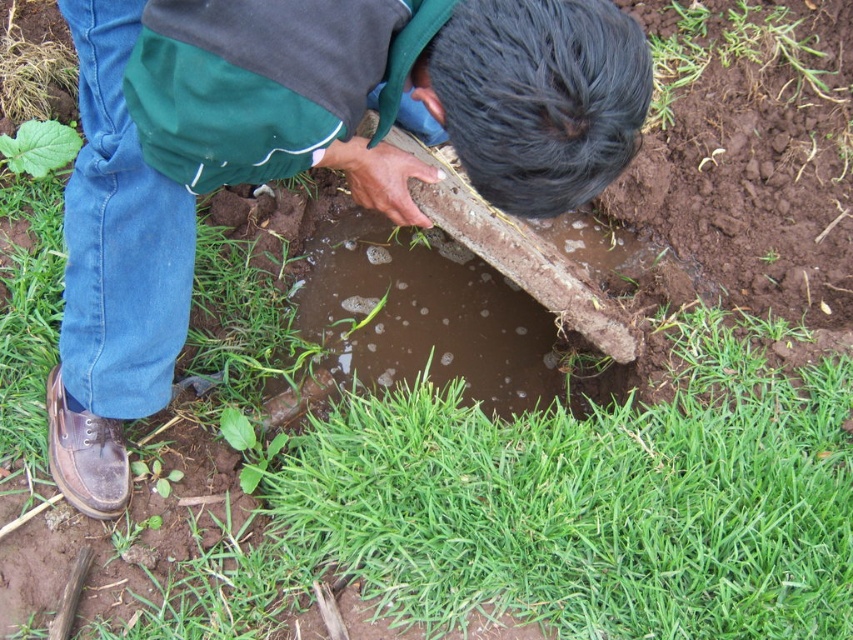
The man is holding a rectangular concrete block. He wants to place it so that it is partially submerged in water. The brown clay shovel at center is in front of green grass at lower center. Where should he place the block relative to the shovel and grass?

The man should place the rectangular concrete block behind the brown clay shovel at center, which is in front of the green grass at lower center, to ensure it is partially submerged in the water.

You are a farmer who needs to choose between the brown clay shovel at center and the green grass at lower center to place in a narrow space. Which object would you choose and why?

You should choose the brown clay shovel at center because its width is less than the green grass at lower center, making it easier to fit into the narrow space.

You are a farmer who needs to reach the green grass at lower center to check its health. You are currently holding the brown clay shovel at center. Which direction should you move the shovel to get closer to the grass?

The brown clay shovel at center is to the left of green grass at lower center, so you should move the shovel to the right to get closer to the green grass at lower center.